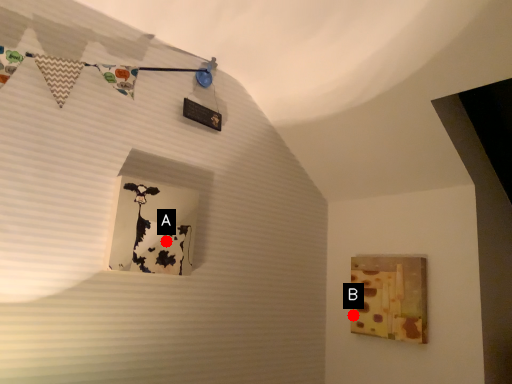
Question: Two points are circled on the image, labeled by A and B beside each circle. Which point appears closest to the camera in this image?

Choices:
 (A) A is closer
 (B) B is closer

Answer: (A)